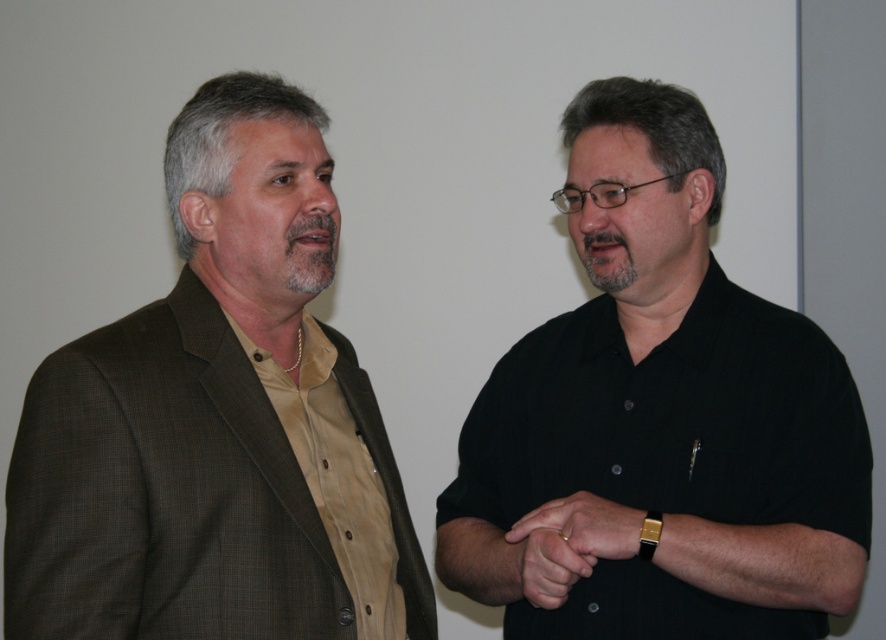
You are a photographer setting up for a portrait session. You need to ensure that the black matte shirt at right and the smooth skin hand at center are both visible in the frame. Based on their sizes, which object should you focus on to ensure both are in the shot?

The black matte shirt at right is wider than the smooth skin hand at center, so focusing on the black matte shirt at right will help ensure both are visible in the frame since it takes up more space.

You are a tailor measuring items for a display case. The display case can only accommodate items wider than 30 cm. Based on the scene, can both the brown textured suit at left and the gold metallic watch at center fit into the display case?

The brown textured suit at left is wider than the gold metallic watch at center. Since the display case requires items wider than 30 cm, the brown textured suit at left likely meets the requirement, but the gold metallic watch at center may not. However, without exact measurements, we cannot be certain.

You are a photographer setting up for a portrait. You need to ensure that the brown textured suit at left and the smooth skin hand at center are both in focus. Which object should you position closer to the camera to achieve this?

To ensure both the brown textured suit at left and the smooth skin hand at center are in focus, position the brown textured suit at left closer to the camera since it is on the left side of the smooth skin hand at center.